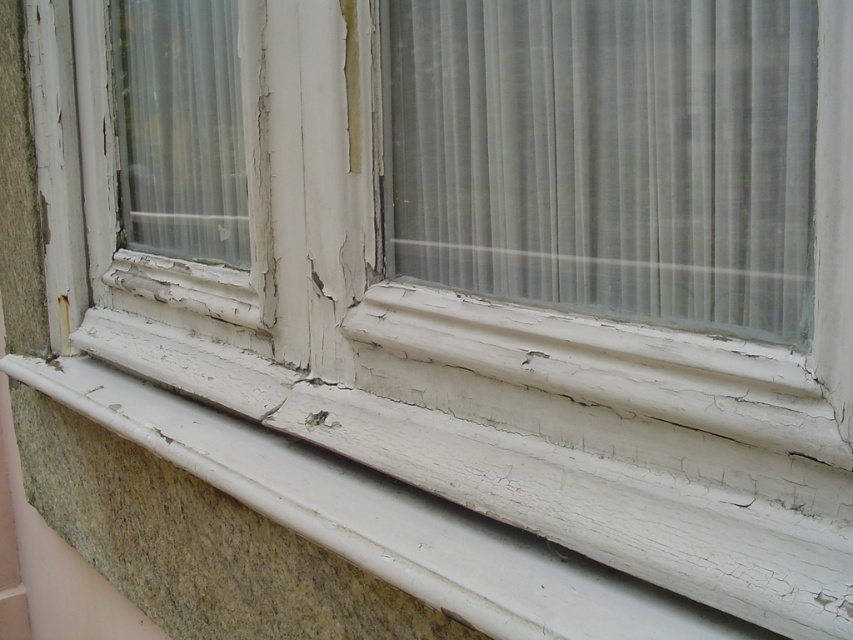
Image resolution: width=853 pixels, height=640 pixels. What do you see at coordinates (606, 156) in the screenshot?
I see `translucent fabric curtain at center` at bounding box center [606, 156].

Does point (498, 36) come closer to viewer compared to point (495, 540)?

No.

The image size is (853, 640). In order to click on translucent fabric curtain at center in this screenshot , I will do `click(606, 156)`.